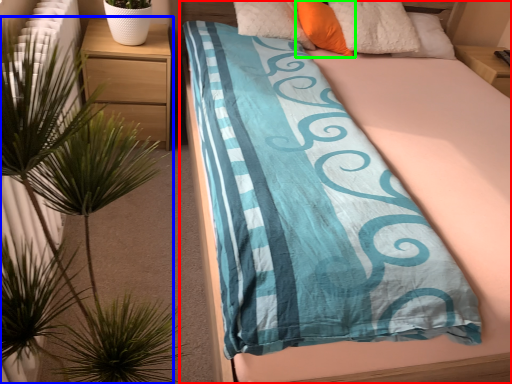
Question: Based on their relative distances, which object is farther from bed (highlighted by a red box)? Choose from houseplant (highlighted by a blue box) and pillow (highlighted by a green box).

Choices:
 (A) houseplant
 (B) pillow

Answer: (A)